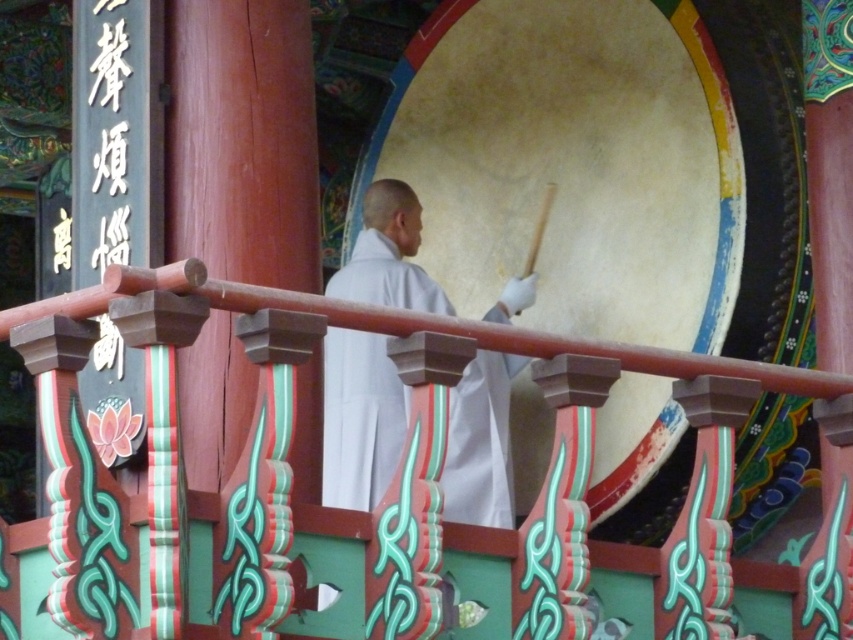
You are a photographer standing at the same position as the white cloth monk at center. You want to take a photo of the smooth beige drum at center. Since you have a camera with a 50mm lens, which has a standard field of view, will you need to move closer or farther away to frame the drum properly?

The smooth beige drum at center is 15.34 feet away from the white cloth monk at center. Since you are positioned where the monk is, you are already 15.34 feet away from the drum. A 50mm lens on a full frame camera has a field of view similar to human vision. To frame the drum properly, you would need to consider its size and desired composition. However, without knowing the drum size, it is hard to determine if you need to move. But since the distance is already set, if the drum fills the frame adequately,

You are standing at the center of the scene and want to place a new decoration exactly at the center of the smooth beige drum at center. What are the coordinates where you should place it?

The coordinates for the center of the smooth beige drum at center are exactly at point (572, 163).